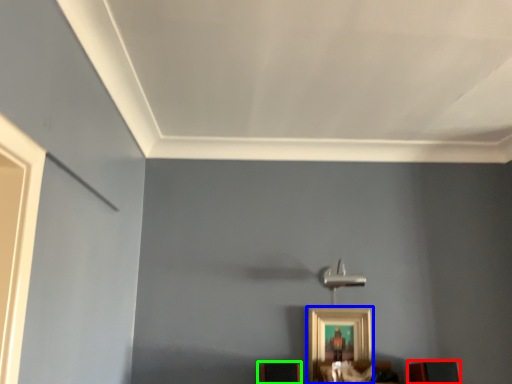
Question: Which object is positioned farthest from furniture (highlighted by a red box)? Select from picture frame (highlighted by a blue box) and furniture (highlighted by a green box).

Choices:
 (A) picture frame
 (B) furniture

Answer: (B)